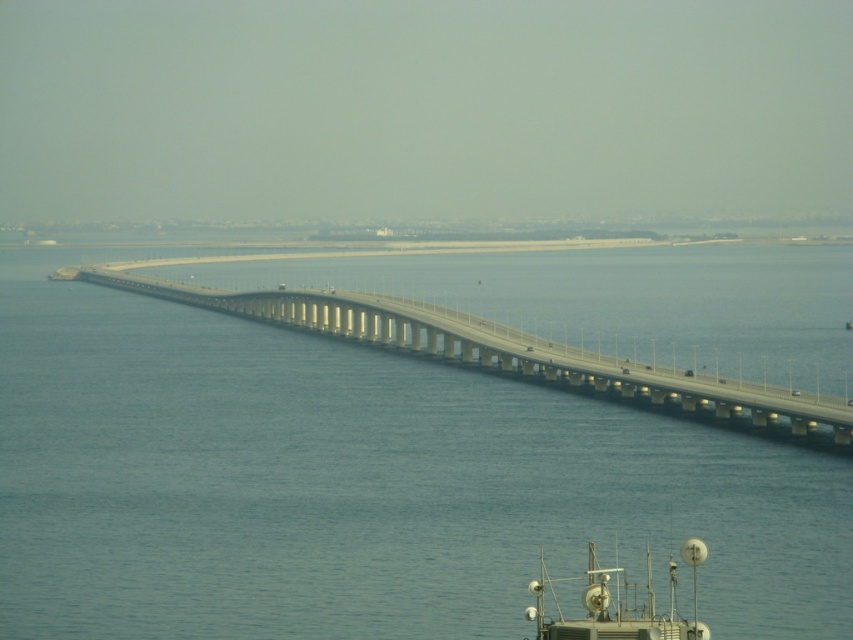
Is blue water at center positioned in front of metallic gray satellite dish at lower right?

No, it is not.

Can you confirm if blue water at center is bigger than metallic gray satellite dish at lower right?

Yes.

Measure the distance between point (360, 346) and camera.

A distance of 642.16 meters exists between point (360, 346) and camera.

Find the location of a particular element. blue water at center is located at coordinates (357, 483).

Between concrete bridge at center and metallic gray satellite dish at lower right, which one appears on the left side from the viewer's perspective?

Positioned to the left is concrete bridge at center.

Which is above, concrete bridge at center or metallic gray satellite dish at lower right?

Positioned higher is concrete bridge at center.

Does point (778, 390) come in front of point (543, 586)?

No, it is not.

The image size is (853, 640). Find the location of `concrete bridge at center`. concrete bridge at center is located at coordinates (511, 355).

Who is lower down, blue water at center or concrete bridge at center?

blue water at center is below.

Between point (236, 358) and point (521, 353), which one is positioned in front?

Point (521, 353) is more forward.

At what (x,y) coordinates should I click in order to perform the action: click on blue water at center. Please return your answer as a coordinate pair (x, y). The height and width of the screenshot is (640, 853). Looking at the image, I should click on (357, 483).